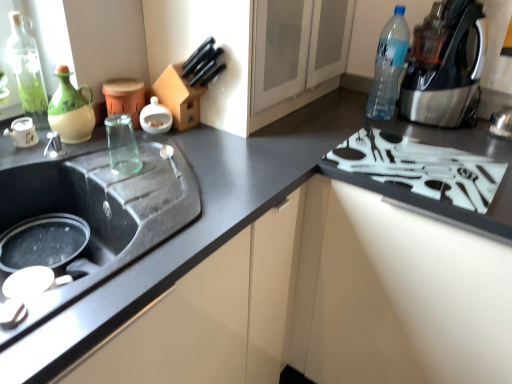
Identify the location of vacant space in between matte glass jar at upper left, acting as the 2th appliance starting from the right, and transparent glass cup at sink. (129, 152).